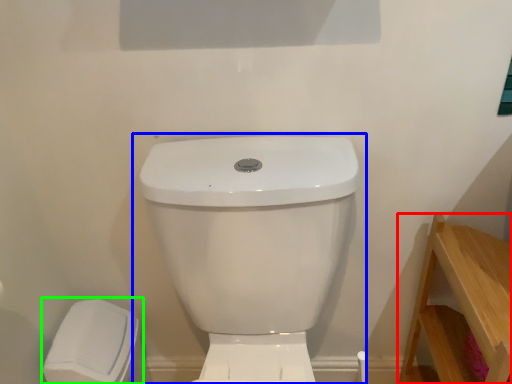
Question: Considering the real-world distances, which object is closest to furniture (highlighted by a red box)? toilet (highlighted by a blue box) or porcelain (highlighted by a green box).

Choices:
 (A) toilet
 (B) porcelain

Answer: (A)